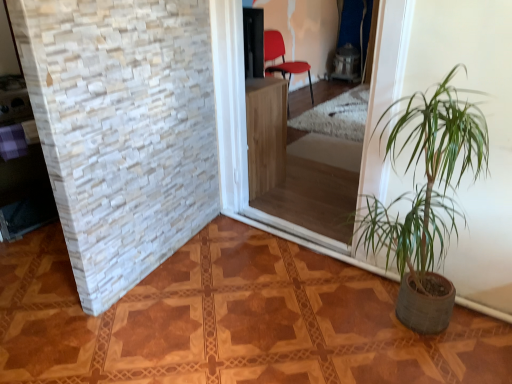
Question: Should I look upward or downward to see matte red chair at center?

Choices:
 (A) up
 (B) down

Answer: (A)